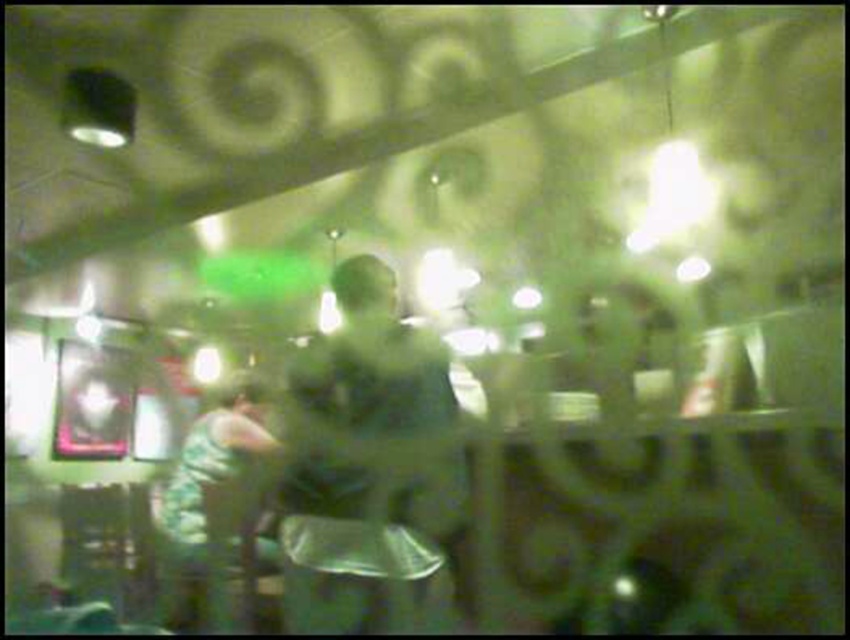
Question: Which of the following is the farthest from the observer?

Choices:
 (A) green matte shirt at center
 (B) green camouflage jacket at left

Answer: (B)

Question: Is green matte shirt at center below green camouflage jacket at left?

Choices:
 (A) yes
 (B) no

Answer: (B)

Question: Is green matte shirt at center bigger than green camouflage jacket at left?

Choices:
 (A) no
 (B) yes

Answer: (A)

Question: Observing the image, what is the correct spatial positioning of green matte shirt at center in reference to green camouflage jacket at left?

Choices:
 (A) left
 (B) right

Answer: (B)

Question: Which of the following is the closest to the observer?

Choices:
 (A) green matte shirt at center
 (B) green camouflage jacket at left

Answer: (A)

Question: Which of the following is the closest to the observer?

Choices:
 (A) [x=409, y=589]
 (B) [x=205, y=534]

Answer: (A)